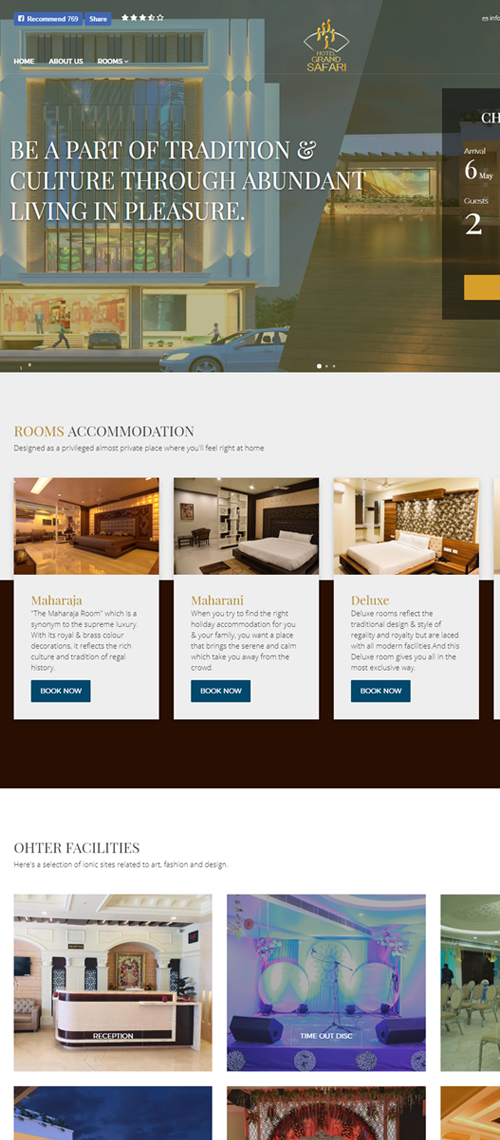
This screenshot has height=1140, width=500. Find the location of `bed`. bed is located at coordinates (398, 549), (291, 539), (113, 545).